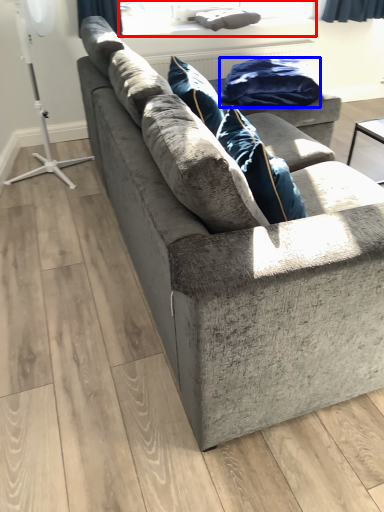
Question: Which object appears closest to the camera in this image, window screen (highlighted by a red box) or material (highlighted by a blue box)?

Choices:
 (A) window screen
 (B) material

Answer: (B)